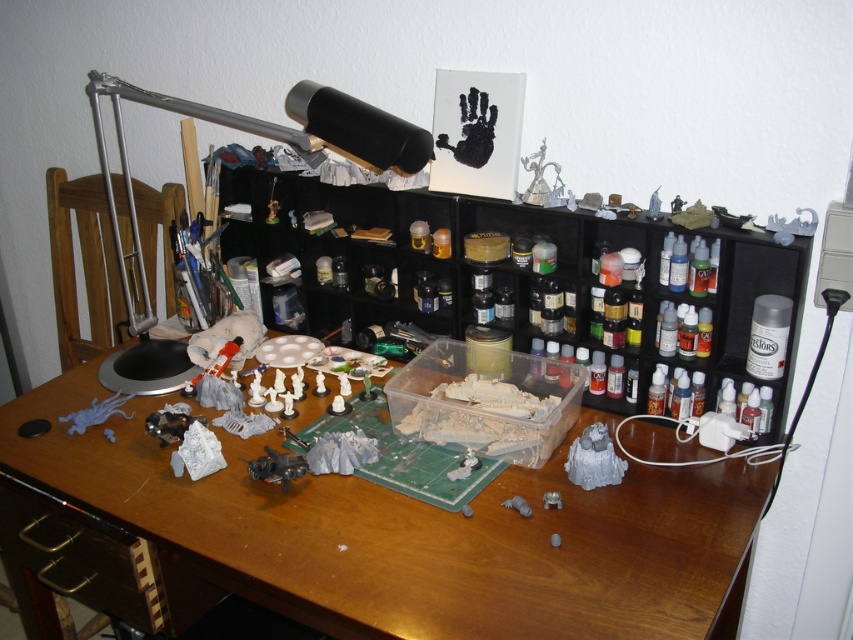
What is the color of the object located at point [408,536]?

The object at point [408,536] is wooden.

You are setting up a new desk arrangement and want to place a decorative item between the black plastic shelf at center and the silver metallic desk lamp at upper left. Based on their widths, which object should you place closer to the edge of the desk to ensure the decorative item fits?

The black plastic shelf at center might be wider than the silver metallic desk lamp at upper left, so placing the silver metallic desk lamp at upper left closer to the edge would leave more space for the decorative item between them.

You are a craftsperson who needs to adjust the silver metallic desk lamp at upper left to get better lighting on the black plastic shelf at center. Considering the lamp has a 12 inch adjustable arm, can you reach the shelf from its current position?

The distance between the black plastic shelf at center and the silver metallic desk lamp at upper left is 13.56 inches. Since the lamp has a 12 inch adjustable arm, it cannot reach the shelf as the required distance exceeds the arm length.